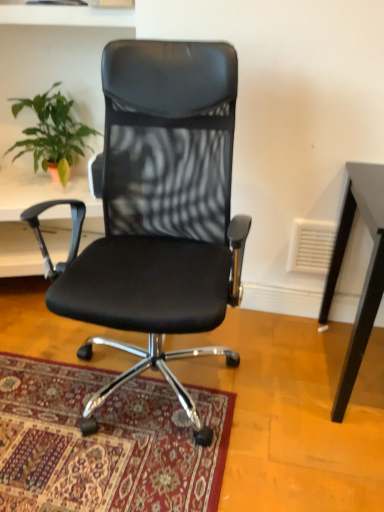
Where is `free point above carpeted rug at center (from a real-world perspective)`? free point above carpeted rug at center (from a real-world perspective) is located at coordinates (71, 413).